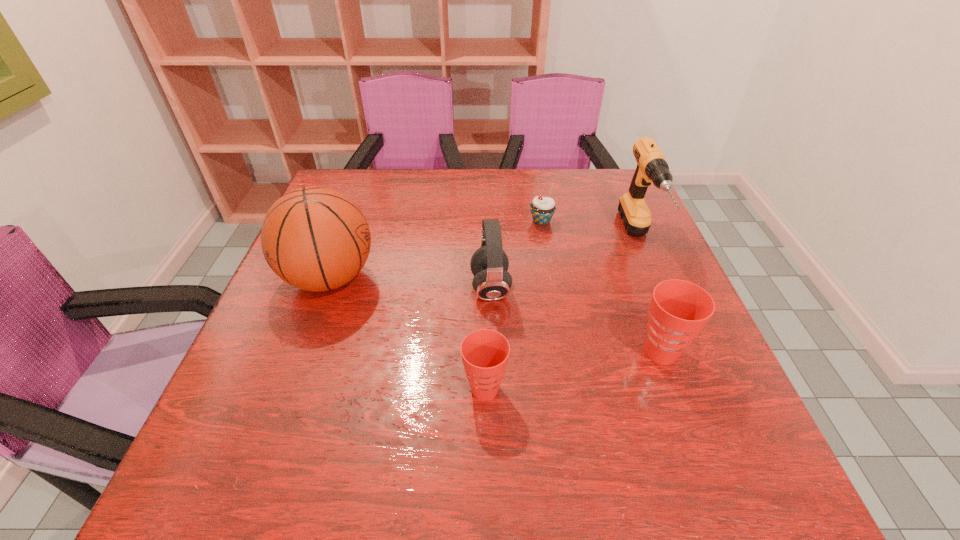
This screenshot has width=960, height=540. Find the location of `the left cup`. the left cup is located at coordinates (485, 352).

In order to click on the taller cup in this screenshot , I will do `click(679, 309)`.

At what (x,y) coordinates should I click in order to perform the action: click on the fourth tallest object. Please return your answer as a coordinate pair (x, y). Looking at the image, I should click on (679, 309).

Find the location of a particular element. The height and width of the screenshot is (540, 960). drill is located at coordinates [x=652, y=167].

Where is `headset`? The width and height of the screenshot is (960, 540). headset is located at coordinates (489, 264).

Locate an element on the screen. basketball is located at coordinates (314, 238).

Identify the location of cupcake. (542, 209).

At what (x,y) coordinates should I click in order to perform the action: click on the third object from right to left. Please return your answer as a coordinate pair (x, y). Image resolution: width=960 pixels, height=540 pixels. Looking at the image, I should click on (542, 209).

At what (x,y) coordinates should I click in order to perform the action: click on blank area located on the left of the left cup. Please return your answer as a coordinate pair (x, y). Looking at the image, I should click on (420, 389).

The width and height of the screenshot is (960, 540). Find the location of `blank area located 0.140m on the back of the fourth tallest object`. blank area located 0.140m on the back of the fourth tallest object is located at coordinates (636, 285).